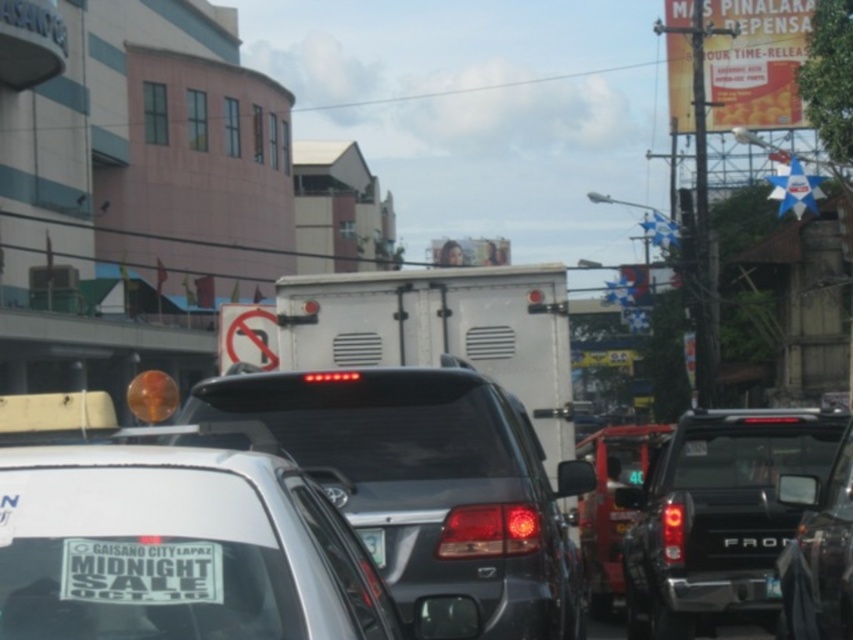
Question: Estimate the real-world distances between objects in this image. Which object is closer to the glossy black truck at right?

Choices:
 (A) glossy black truck at center-right
 (B) metallic red car at center-right
 (C) white glossy car at center

Answer: (A)

Question: Which of the following is the farthest from the observer?

Choices:
 (A) tap(115, 579)
 (B) tap(801, 516)
 (C) tap(378, 518)
 (D) tap(759, 544)

Answer: (D)

Question: Is metallic red car at center-right closer to camera compared to black plastic license plate at center?

Choices:
 (A) yes
 (B) no

Answer: (B)

Question: Can you confirm if white glossy car at center is positioned below black plastic license plate at center?

Choices:
 (A) yes
 (B) no

Answer: (B)

Question: Can you confirm if glossy black truck at right is positioned to the left of black plastic license plate at center?

Choices:
 (A) yes
 (B) no

Answer: (A)

Question: Based on their relative distances, which object is farther from the black plastic license plate at center?

Choices:
 (A) glossy black car at center
 (B) white sticker at lower center
 (C) metallic red car at center-right
 (D) white glossy car at center

Answer: (B)